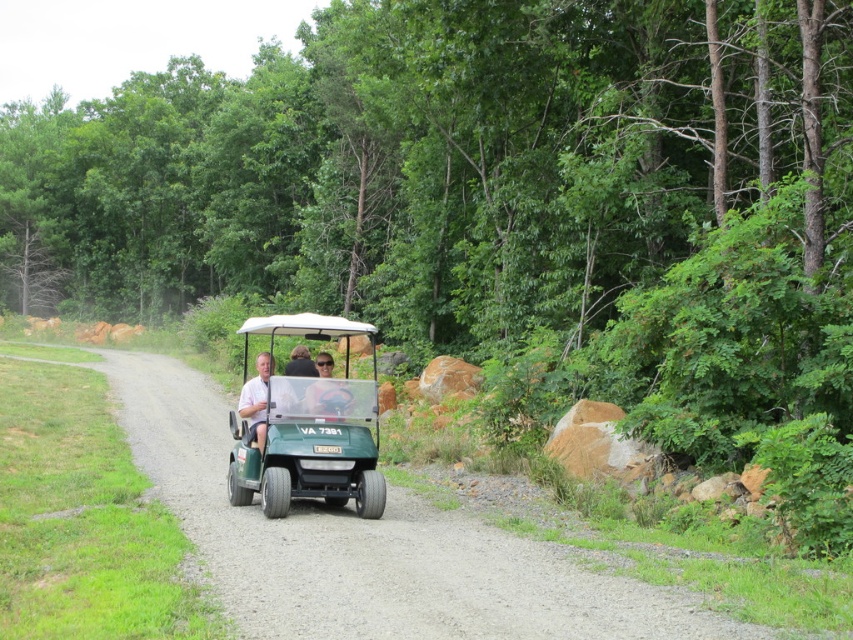
You are a visitor at a golf course and see two golf carts, the green matte golf cart at center and the white matte golf cart at center. Which one is bigger?

The green matte golf cart at center is larger in size than the white matte golf cart at center.

You are a visitor at a golf course and need to take a photo of the green matte golf cart at center and the white matte golf cart at center. Which one should you focus on first to ensure it appears larger in your photo?

The green matte golf cart at center is closer to the viewer than the white matte golf cart at center, so focusing on the green matte golf cart at center first will make it appear larger in the photo.

In the scene shown: You are a GPS system trying to locate the green matte golf cart at center in a 2D coordinate system. What are its coordinates?

The green matte golf cart at center is located at coordinates (305, 428).